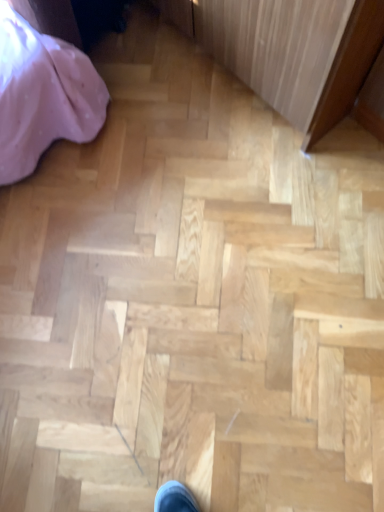
The image size is (384, 512). What do you see at coordinates (42, 95) in the screenshot? I see `pink fabric at upper left` at bounding box center [42, 95].

You are a GUI agent. You are given a task and a screenshot of the screen. Output one action in this format:
    pyautogui.click(x=<x>, y=<y>)
    Task: Click on the pink fabric at upper left
    This screenshot has width=384, height=512.
    Given the screenshot: What is the action you would take?
    pyautogui.click(x=42, y=95)

Locate an element on the screen. This screenshot has width=384, height=512. pink fabric at upper left is located at coordinates (42, 95).